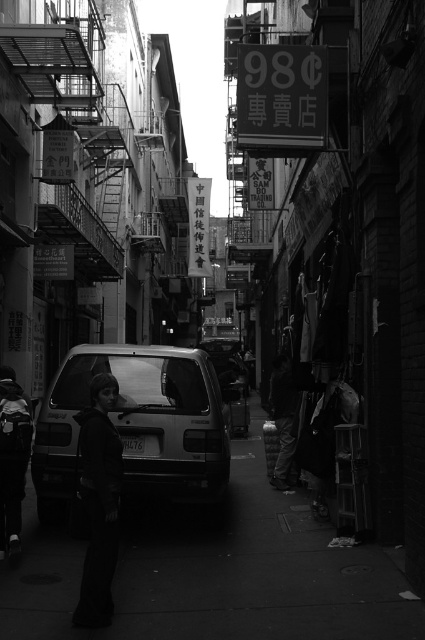
You are a delivery person carrying a package that requires a 2.5 meter clearance to maneuver safely. You need to pass between the smooth concrete pavement at lower center and the dark fabric jacket at center. Is there enough space for you to pass safely?

The distance between the smooth concrete pavement at lower center and the dark fabric jacket at center is 2.53 meters, which is slightly more than the required 2.5 meter clearance. Therefore, there is enough space for the delivery person to pass safely.

You are a delivery person in the alley and need to hand over a package to the person wearing the dark fabric jacket at center. Where exactly should you look to find them?

The dark fabric jacket at center is located at coordinates point (99, 500), so you should look there to find the person wearing it.